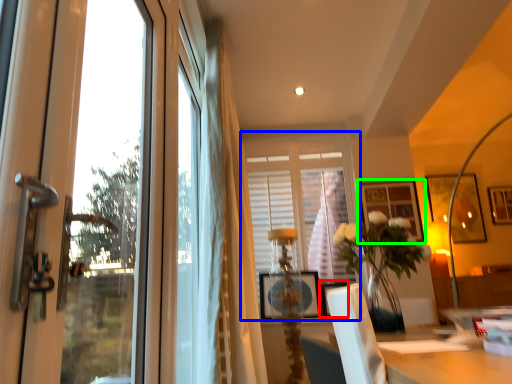
Question: Estimate the real-world distances between objects in this image. Which object is closer to picture frame (highlighted by a red box), window (highlighted by a blue box) or picture frame (highlighted by a green box)?

Choices:
 (A) window
 (B) picture frame

Answer: (A)